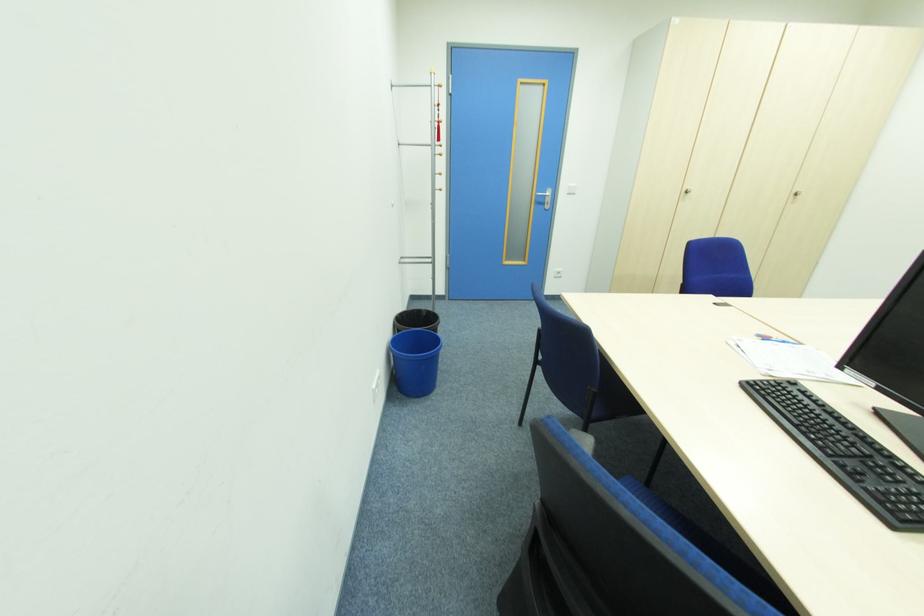
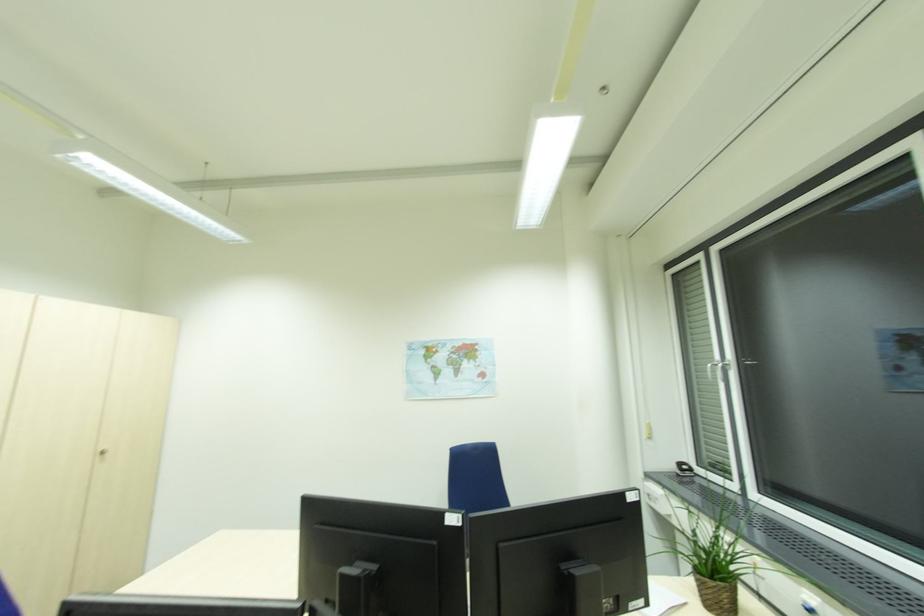
Question: The camera is either moving clockwise (left) or counter-clockwise (right) around the object. The first image is from the beginning of the video and the second image is from the end. Is the camera moving left or right when shooting the video?

Choices:
 (A) Left
 (B) Right

Answer: (A)